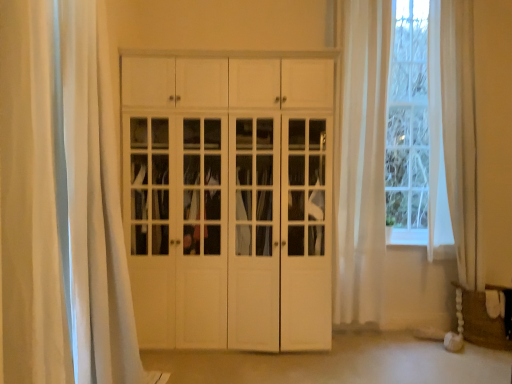
Question: From the image's perspective, is white sheer curtain at left, which appears as the second curtain when viewed from the right, beneath white matte cabinet at center?

Choices:
 (A) no
 (B) yes

Answer: (A)

Question: Is white sheer curtain at left, which appears as the second curtain when viewed from the right, to the right of white matte cabinet at center from the viewer's perspective?

Choices:
 (A) no
 (B) yes

Answer: (A)

Question: Is white sheer curtain at left, marked as the 1th curtain in a front-to-back arrangement, smaller than white matte cabinet at center?

Choices:
 (A) no
 (B) yes

Answer: (B)

Question: Does white sheer curtain at left, which appears as the second curtain when viewed from the right, appear on the left side of white matte cabinet at center?

Choices:
 (A) yes
 (B) no

Answer: (A)

Question: Considering the relative sizes of white sheer curtain at left, the 1th curtain positioned from the left, and white matte cabinet at center in the image provided, is white sheer curtain at left, the 1th curtain positioned from the left, thinner than white matte cabinet at center?

Choices:
 (A) no
 (B) yes

Answer: (B)

Question: Based on their sizes in the image, would you say brown woven basket at lower right is bigger or smaller than white sheer curtain at left, marked as the 1th curtain in a front-to-back arrangement?

Choices:
 (A) small
 (B) big

Answer: (A)

Question: Choose the correct answer: Is brown woven basket at lower right inside white sheer curtain at left, the 1th curtain positioned from the left, or outside it?

Choices:
 (A) inside
 (B) outside

Answer: (B)

Question: Considering the positions of brown woven basket at lower right and white sheer curtain at left, marked as the 1th curtain in a front-to-back arrangement, in the image, is brown woven basket at lower right taller or shorter than white sheer curtain at left, marked as the 1th curtain in a front-to-back arrangement,?

Choices:
 (A) tall
 (B) short

Answer: (B)

Question: Would you say brown woven basket at lower right is to the left or to the right of white sheer curtain at left, which appears as the second curtain when viewed from the right, in the picture?

Choices:
 (A) left
 (B) right

Answer: (B)

Question: Is white sheer curtain at left, the second curtain viewed from the back, wider or thinner than sheer white curtain at right, which appears as the first curtain when viewed from the back?

Choices:
 (A) wide
 (B) thin

Answer: (B)

Question: Based on their sizes in the image, would you say white sheer curtain at left, marked as the 1th curtain in a front-to-back arrangement, is bigger or smaller than sheer white curtain at right, which ranks as the first curtain in right-to-left order?

Choices:
 (A) big
 (B) small

Answer: (B)

Question: Is white sheer curtain at left, the 1th curtain positioned from the left, in front of or behind sheer white curtain at right, which appears as the first curtain when viewed from the back, in the image?

Choices:
 (A) front
 (B) behind

Answer: (A)

Question: From their relative heights in the image, would you say white sheer curtain at left, which appears as the second curtain when viewed from the right, is taller or shorter than sheer white curtain at right, which ranks as the second curtain in front-to-back order?

Choices:
 (A) tall
 (B) short

Answer: (B)

Question: From a real-world perspective, relative to white matte cabinet at center, is sheer white curtain at right, which ranks as the first curtain in right-to-left order, vertically above or below?

Choices:
 (A) below
 (B) above

Answer: (B)

Question: Considering the positions of sheer white curtain at right, which ranks as the second curtain in front-to-back order, and white matte cabinet at center in the image, is sheer white curtain at right, which ranks as the second curtain in front-to-back order, taller or shorter than white matte cabinet at center?

Choices:
 (A) tall
 (B) short

Answer: (A)